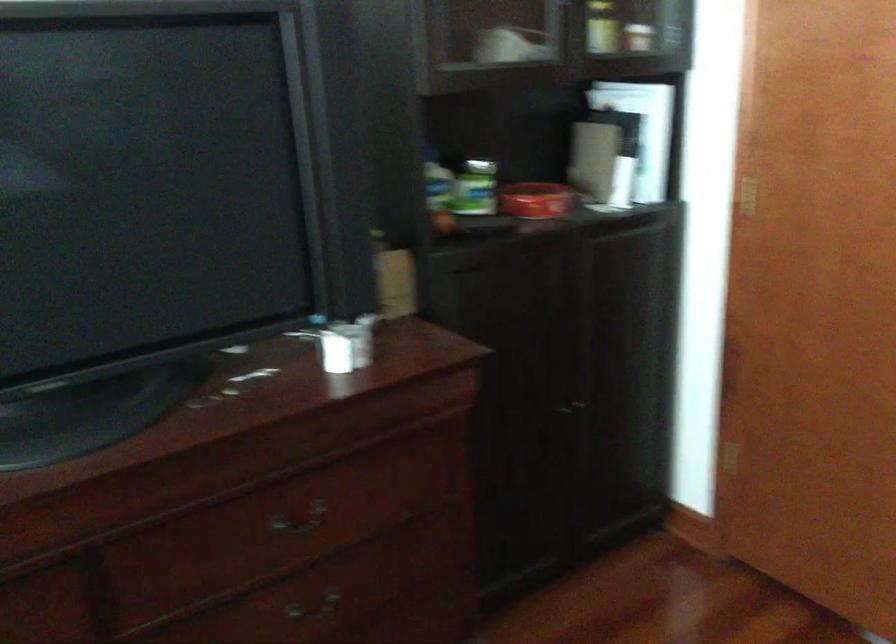
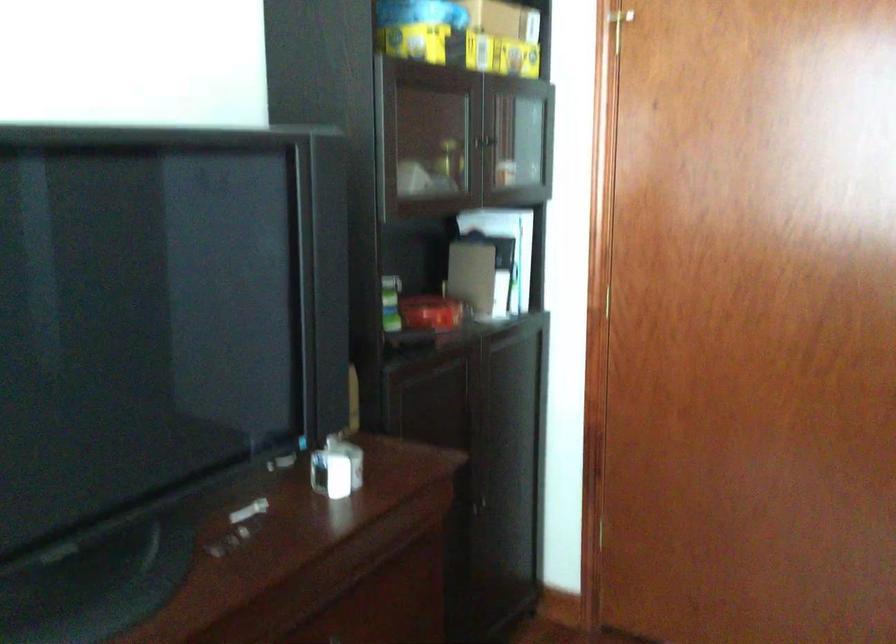
In the second image, find the point that corresponds to point 630,156 in the first image.

(503, 272)